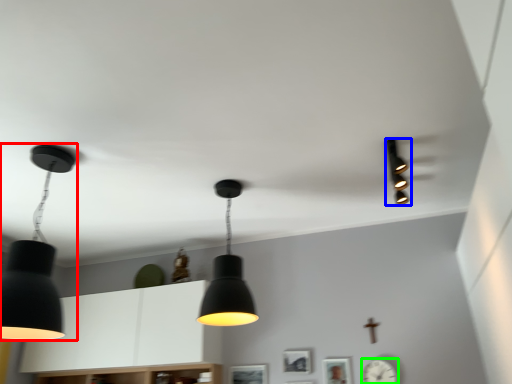
Question: Which object is positioned closest to lamp (highlighted by a red box)? Select from lamp (highlighted by a blue box) and clock (highlighted by a green box).

Choices:
 (A) lamp
 (B) clock

Answer: (A)